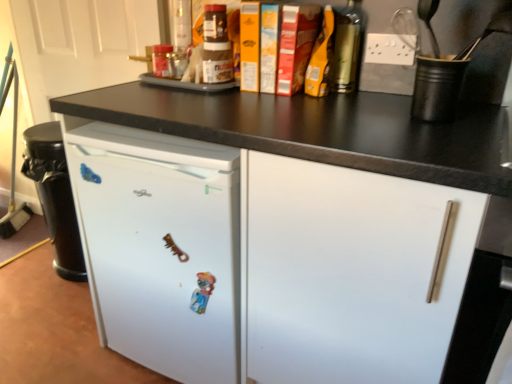
Where is `free space above white matte drawer at center (from a real-world perspective)`? free space above white matte drawer at center (from a real-world perspective) is located at coordinates (409, 122).